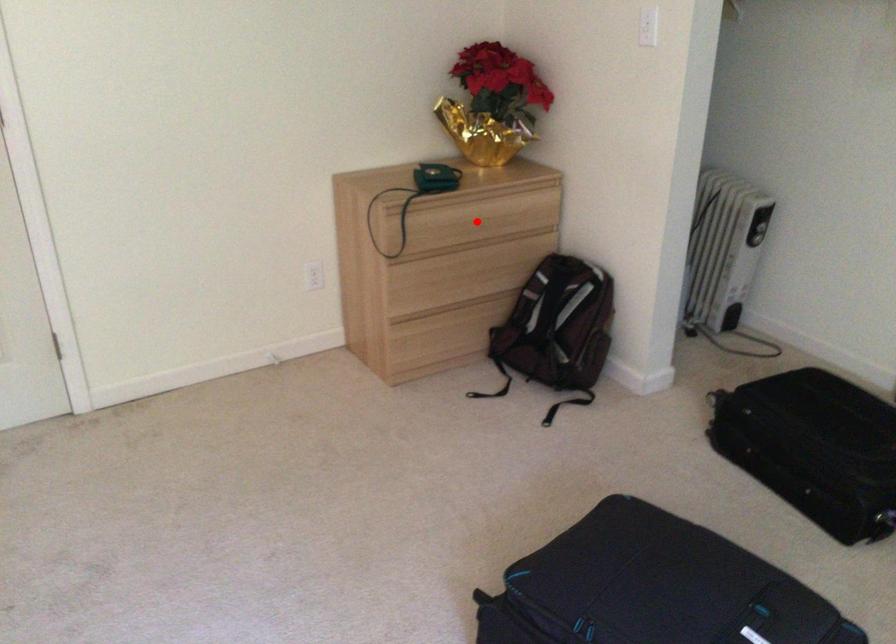
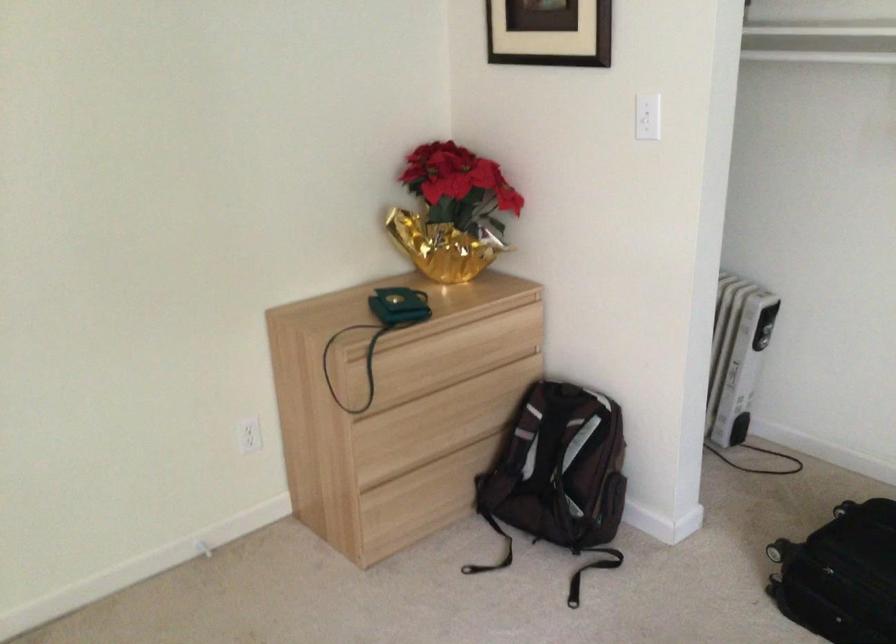
Question: I am providing you with two images of the same scene from different viewpoints. A red point is shown in image1. For the corresponding object point in image2, is it positioned nearer or farther from the camera?

Choices:
 (A) Nearer
 (B) Farther

Answer: (A)